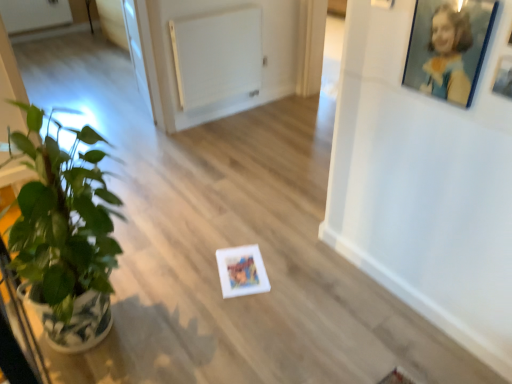
Question: Can you confirm if white matte radiator at upper center is wider than green glossy houseplant at left?

Choices:
 (A) yes
 (B) no

Answer: (B)

Question: Is green glossy houseplant at left a part of white matte radiator at upper center?

Choices:
 (A) yes
 (B) no

Answer: (B)

Question: Does white matte radiator at upper center have a lesser width compared to green glossy houseplant at left?

Choices:
 (A) no
 (B) yes

Answer: (B)

Question: From the image's perspective, is white matte radiator at upper center above green glossy houseplant at left?

Choices:
 (A) no
 (B) yes

Answer: (B)

Question: From a real-world perspective, is white matte radiator at upper center positioned under green glossy houseplant at left based on gravity?

Choices:
 (A) yes
 (B) no

Answer: (A)

Question: Is white matte radiator at upper center positioned far away from green glossy houseplant at left?

Choices:
 (A) yes
 (B) no

Answer: (A)

Question: Is white matte radiator at upper center positioned beyond the bounds of blue glossy picture frame at upper right, which is the 1th picture frame from left to right?

Choices:
 (A) yes
 (B) no

Answer: (A)

Question: Does white matte radiator at upper center have a smaller size compared to blue glossy picture frame at upper right, the second picture frame when ordered from right to left?

Choices:
 (A) no
 (B) yes

Answer: (A)

Question: From a real-world perspective, is white matte radiator at upper center under blue glossy picture frame at upper right, the second picture frame when ordered from right to left?

Choices:
 (A) yes
 (B) no

Answer: (A)

Question: Is white matte radiator at upper center at the left side of blue glossy picture frame at upper right, the second picture frame when ordered from right to left?

Choices:
 (A) yes
 (B) no

Answer: (A)

Question: From a real-world perspective, is white matte radiator at upper center positioned over blue glossy picture frame at upper right, which is the 1th picture frame from left to right, based on gravity?

Choices:
 (A) yes
 (B) no

Answer: (B)

Question: Does white matte radiator at upper center lie in front of blue glossy picture frame at upper right, which is the 1th picture frame from left to right?

Choices:
 (A) yes
 (B) no

Answer: (B)

Question: From a real-world perspective, is blue glossy picture frame at upper right, which is the 1th picture frame from left to right, on green glossy houseplant at left?

Choices:
 (A) yes
 (B) no

Answer: (A)